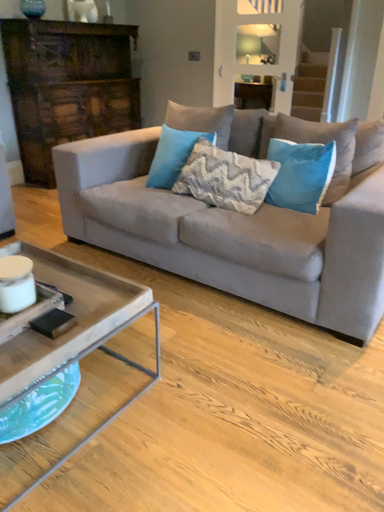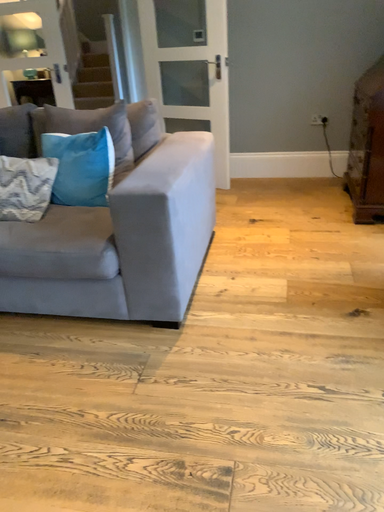
Question: Which way did the camera rotate in the video?

Choices:
 (A) rotated left
 (B) rotated right

Answer: (B)